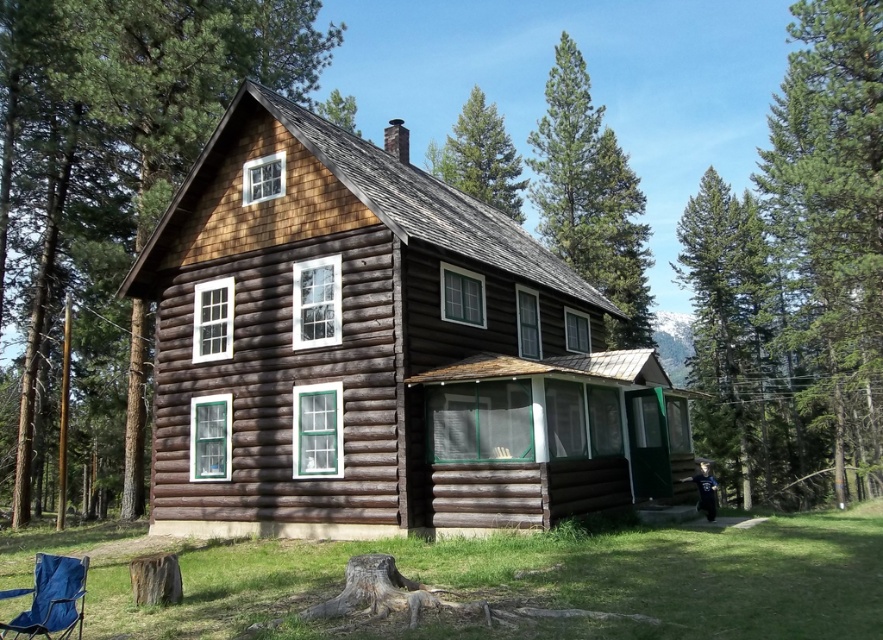
From the picture: You are standing in front of the wooden log cabin at center and looking up. Do you see the green pine tree at upper center above the cabin?

Yes, the wooden log cabin at center is positioned under the green pine tree at upper center, so when you look up from the cabin, you will see the green pine tree at upper center above it.

You are standing in front of the wooden log cabin at center and looking towards the green pine tree at upper center. Which object is closer to you?

The wooden log cabin at center is closer to you than the green pine tree at upper center.

Based on the photo, you are standing at the point marked by the coordinates point (590, 196) in the image of the rustic log cabin. What object is located at this position?

The point (590, 196) indicates green pine tree at upper center.